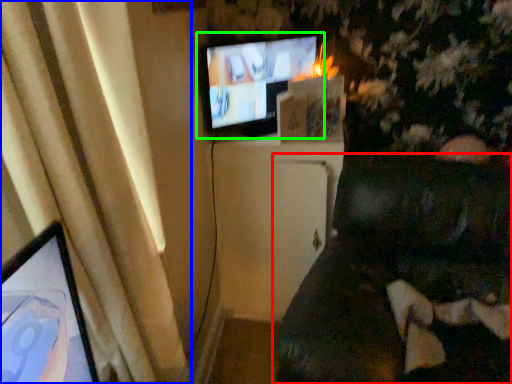
Question: Which object is positioned closest to furniture (highlighted by a red box)? Select from curtain (highlighted by a blue box) and television (highlighted by a green box).

Choices:
 (A) curtain
 (B) television

Answer: (B)